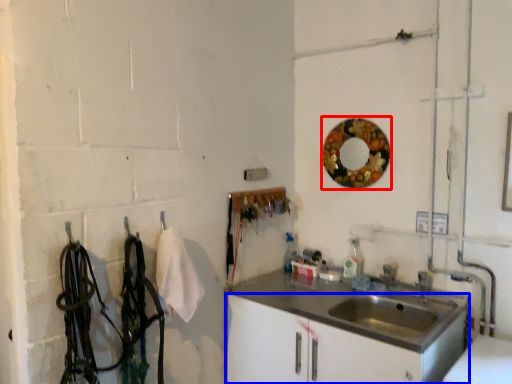
Question: Which of the following is the farthest to the observer, mirror (highlighted by a red box) or bathroom cabinet (highlighted by a blue box)?

Choices:
 (A) mirror
 (B) bathroom cabinet

Answer: (A)